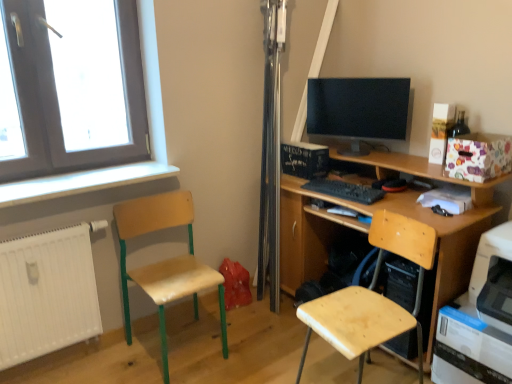
Where is `vacant location behind wooden chair at lower right, which appears as the 2th chair when viewed from the left`? vacant location behind wooden chair at lower right, which appears as the 2th chair when viewed from the left is located at coordinates (324, 354).